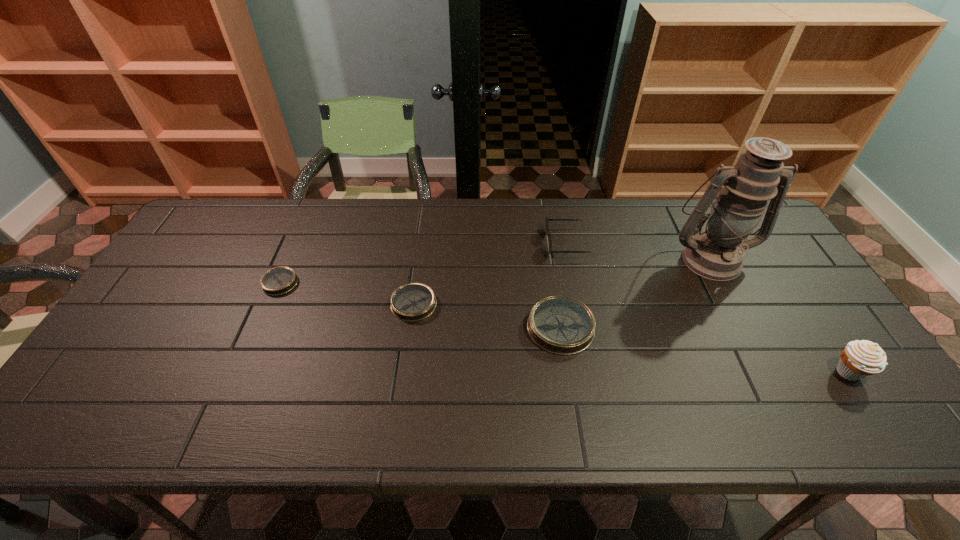
You are a GUI agent. You are given a task and a screenshot of the screen. Output one action in this format:
    pyautogui.click(x=<x>, y=<y>)
    Task: Click on the vacant place for an extra compass on the right
    The height and width of the screenshot is (540, 960).
    Given the screenshot: What is the action you would take?
    pyautogui.click(x=723, y=353)